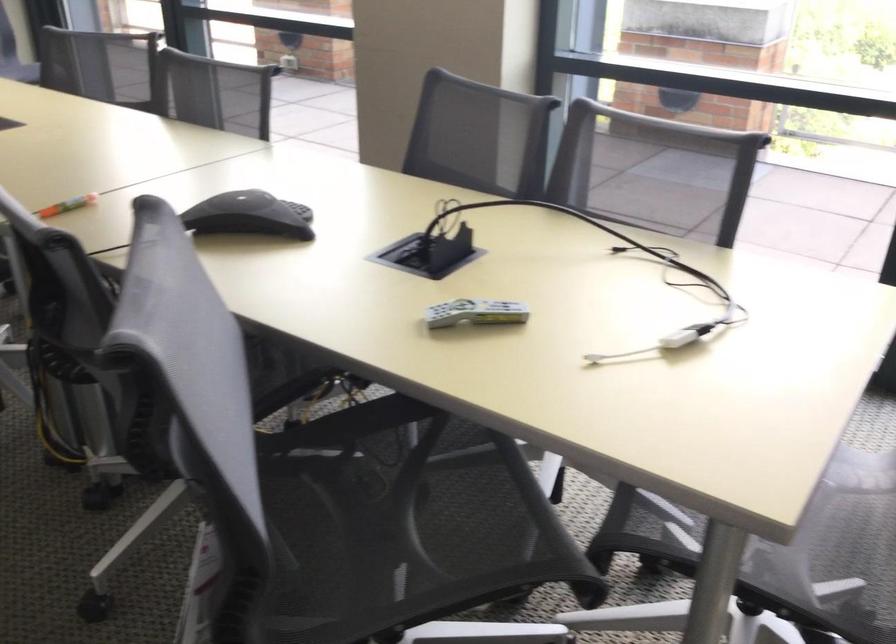
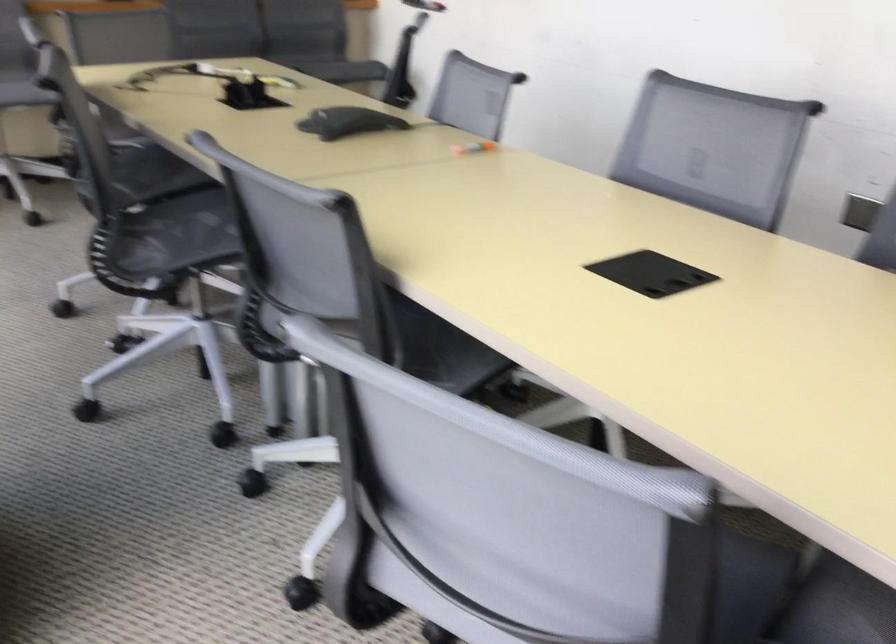
Find the pixel in the second image that matches (x=236, y=207) in the first image.

(348, 122)